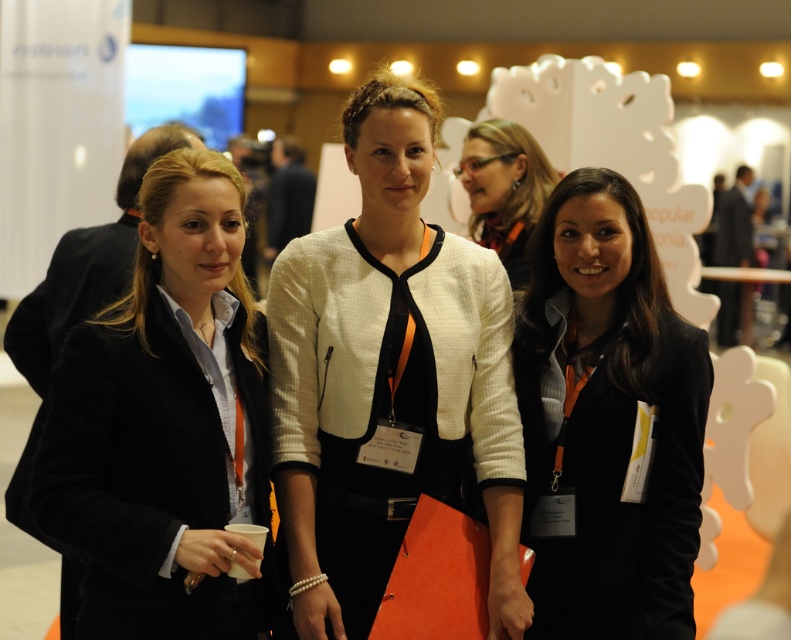
You are a photographer adjusting your camera settings to focus on two specific points in the image. The first point is at coordinates point (407, 298) and the second is at point (506, 209). Which point should you focus on first if you want to ensure the closest object is in sharp focus?

Point (407, 298) is closer to the viewer than point (506, 209), so you should focus on point (407, 298) first to ensure the closest object is in sharp focus.

You are a photographer at a professional event. You need to capture a closeup shot of the black matte blazer at center and the matte black jacket at center. Given that your camera can only focus on objects within 3 feet, will both items be in focus?

The black matte blazer at center is 3.73 feet away from the matte black jacket at center. Since the distance between them is greater than 3 feet, the camera cannot focus on both items simultaneously within the 3 feet range.

You are a photographer at a professional event. You notice two jackets in the scene described. Which jacket is closer to the camera, the white textured blazer at center or the matte black jacket at center?

The white textured blazer at center is closer to the camera because it is in front of the matte black jacket at center.